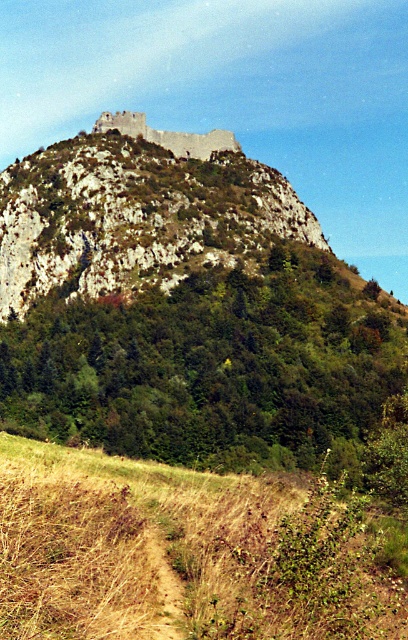
Who is positioned more to the right, rugged stone mountain at upper center or stone wall at upper center?

From the viewer's perspective, stone wall at upper center appears more on the right side.

Is point (181, 192) closer to camera compared to point (161, 132)?

Yes, it is.

Is point (0, 246) positioned before point (164, 131)?

Yes.

You are a GUI agent. You are given a task and a screenshot of the screen. Output one action in this format:
    pyautogui.click(x=<x>, y=<y>)
    Task: Click on the rugged stone mountain at upper center
    This screenshot has height=640, width=408.
    Given the screenshot: What is the action you would take?
    pyautogui.click(x=137, y=214)

Can you confirm if brown dry grass at lower left is positioned above rugged stone mountain at upper center?

Incorrect, brown dry grass at lower left is not positioned above rugged stone mountain at upper center.

Does point (93, 620) come closer to viewer compared to point (183, 170)?

Yes, it is.

The width and height of the screenshot is (408, 640). In order to click on brown dry grass at lower left in this screenshot , I will do pos(179,554).

Does point (133, 113) come behind point (150, 548)?

That is True.

Who is more distant from viewer, (110, 129) or (170, 576)?

Positioned behind is point (110, 129).

What are the coordinates of `stone wall at upper center` in the screenshot? It's located at (168, 134).